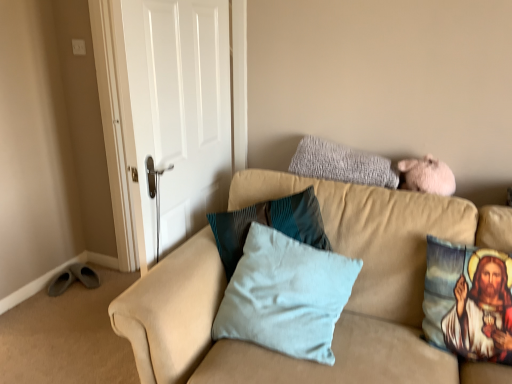
Where is `beige fabric couch at upper right`? The height and width of the screenshot is (384, 512). beige fabric couch at upper right is located at coordinates (345, 306).

I want to click on light blue fabric pillow at center, positioned as the first pillow in left-to-right order, so click(286, 295).

This screenshot has width=512, height=384. What do you see at coordinates (468, 301) in the screenshot?
I see `printed fabric pillow with religious image at right, the third pillow when ordered from left to right` at bounding box center [468, 301].

The image size is (512, 384). What do you see at coordinates (341, 164) in the screenshot? I see `gray fluffy pillow at upper right, which is the second pillow in right-to-left order` at bounding box center [341, 164].

Where is `white matte door at upper left`? The width and height of the screenshot is (512, 384). white matte door at upper left is located at coordinates (174, 114).

The width and height of the screenshot is (512, 384). Find the location of `beige fabric couch at upper right`. beige fabric couch at upper right is located at coordinates (345, 306).

Is gray fluffy pillow at upper right, placed as the second pillow when sorted from left to right, positioned with its back to white matte door at upper left?

gray fluffy pillow at upper right, placed as the second pillow when sorted from left to right, is not turned away from white matte door at upper left.

Does gray fluffy pillow at upper right, placed as the second pillow when sorted from left to right, lie behind white matte door at upper left?

Yes, gray fluffy pillow at upper right, placed as the second pillow when sorted from left to right, is further from the viewer.

Is gray fluffy pillow at upper right, placed as the second pillow when sorted from left to right, next to white matte door at upper left?

No.

Considering the positions of point (182, 310) and point (330, 299), is point (182, 310) closer or farther from the camera than point (330, 299)?

Point (182, 310) appears to be closer to the viewer than point (330, 299).

Is beige fabric couch at upper right turned away from light blue fabric pillow at center, the third pillow positioned from the right?

Yes, beige fabric couch at upper right's orientation is away from light blue fabric pillow at center, the third pillow positioned from the right.

From a real-world perspective, relative to light blue fabric pillow at center, the third pillow positioned from the right, is beige fabric couch at upper right vertically above or below?

In terms of real-world spatial position, beige fabric couch at upper right is below light blue fabric pillow at center, the third pillow positioned from the right.

Can you confirm if white matte door at upper left is bigger than printed fabric pillow with religious image at right, the third pillow when ordered from left to right?

Yes.

Is printed fabric pillow with religious image at right, positioned as the 1th pillow in right-to-left order, a part of white matte door at upper left?

That's incorrect, printed fabric pillow with religious image at right, positioned as the 1th pillow in right-to-left order, is not inside white matte door at upper left.

From the image's perspective, is white matte door at upper left beneath printed fabric pillow with religious image at right, positioned as the 1th pillow in right-to-left order?

No, from the image's perspective, white matte door at upper left is not beneath printed fabric pillow with religious image at right, positioned as the 1th pillow in right-to-left order.

Does white matte door at upper left have a lesser width compared to printed fabric pillow with religious image at right, the third pillow when ordered from left to right?

Indeed, white matte door at upper left has a lesser width compared to printed fabric pillow with religious image at right, the third pillow when ordered from left to right.

Considering the points (280, 347) and (475, 270), which point is in front, point (280, 347) or point (475, 270)?

Positioned in front is point (280, 347).

Between light blue fabric pillow at center, the third pillow positioned from the right, and printed fabric pillow with religious image at right, the third pillow when ordered from left to right, which one is positioned in front?

light blue fabric pillow at center, the third pillow positioned from the right.

From a real-world perspective, is light blue fabric pillow at center, the third pillow positioned from the right, positioned under printed fabric pillow with religious image at right, positioned as the 1th pillow in right-to-left order, based on gravity?

Yes.

Does light blue fabric pillow at center, positioned as the first pillow in left-to-right order, touch printed fabric pillow with religious image at right, the third pillow when ordered from left to right?

No, light blue fabric pillow at center, positioned as the first pillow in left-to-right order, is not next to printed fabric pillow with religious image at right, the third pillow when ordered from left to right.

How different are the orientations of white matte door at upper left and light blue fabric pillow at center, positioned as the first pillow in left-to-right order, in degrees?

white matte door at upper left and light blue fabric pillow at center, positioned as the first pillow in left-to-right order, are facing 89 degrees away from each other.

Does white matte door at upper left lie behind light blue fabric pillow at center, the third pillow positioned from the right?

Yes, it is behind light blue fabric pillow at center, the third pillow positioned from the right.

From the image's perspective, would you say white matte door at upper left is positioned over light blue fabric pillow at center, the third pillow positioned from the right?

Yes, from the image's perspective, white matte door at upper left is over light blue fabric pillow at center, the third pillow positioned from the right.

Looking at this image, is gray fluffy pillow at upper right, which is the second pillow in right-to-left order, far from light blue fabric pillow at center, positioned as the first pillow in left-to-right order?

Actually, gray fluffy pillow at upper right, which is the second pillow in right-to-left order, and light blue fabric pillow at center, positioned as the first pillow in left-to-right order, are a little close together.

Between point (326, 148) and point (286, 264), which one is positioned behind?

The point (326, 148) is farther.

Could you tell me if gray fluffy pillow at upper right, which is the second pillow in right-to-left order, is turned towards light blue fabric pillow at center, positioned as the first pillow in left-to-right order?

No, gray fluffy pillow at upper right, which is the second pillow in right-to-left order, does not turn towards light blue fabric pillow at center, positioned as the first pillow in left-to-right order.

From the image's perspective, which is above, white matte door at upper left or beige fabric couch at upper right?

white matte door at upper left appears higher in the image.

Does white matte door at upper left appear on the left side of beige fabric couch at upper right?

Correct, you'll find white matte door at upper left to the left of beige fabric couch at upper right.

Between point (176, 111) and point (161, 372), which one is positioned in front?

The point (161, 372) is closer to the camera.

Which of these two, white matte door at upper left or beige fabric couch at upper right, is bigger?

Bigger between the two is beige fabric couch at upper right.

From a real-world perspective, which pillow is the 1st one underneath the white matte door at upper left? Please provide its 2D coordinates.

[(341, 164)]

I want to click on the 2nd pillow above the beige fabric couch at upper right (from the image's perspective), so click(286, 295).

Looking at the image, which one is located closer to gray fluffy pillow at upper right, placed as the second pillow when sorted from left to right, beige fabric couch at upper right or light blue fabric pillow at center, positioned as the first pillow in left-to-right order?

Among the two, beige fabric couch at upper right is located nearer to gray fluffy pillow at upper right, placed as the second pillow when sorted from left to right.

Based on the photo, which object lies nearer to the anchor point gray fluffy pillow at upper right, which is the second pillow in right-to-left order, beige fabric couch at upper right or printed fabric pillow with religious image at right, positioned as the 1th pillow in right-to-left order?

beige fabric couch at upper right.

Based on their spatial positions, is beige fabric couch at upper right or white matte door at upper left further from light blue fabric pillow at center, positioned as the first pillow in left-to-right order?

white matte door at upper left.

Which object lies nearer to the anchor point printed fabric pillow with religious image at right, the third pillow when ordered from left to right, gray fluffy pillow at upper right, which is the second pillow in right-to-left order, or light blue fabric pillow at center, the third pillow positioned from the right?

The object closer to printed fabric pillow with religious image at right, the third pillow when ordered from left to right, is light blue fabric pillow at center, the third pillow positioned from the right.

Looking at the image, which one is located closer to beige fabric couch at upper right, gray fluffy pillow at upper right, which is the second pillow in right-to-left order, or light blue fabric pillow at center, positioned as the first pillow in left-to-right order?

Based on the image, light blue fabric pillow at center, positioned as the first pillow in left-to-right order, appears to be nearer to beige fabric couch at upper right.

When comparing their distances from gray fluffy pillow at upper right, which is the second pillow in right-to-left order, does white matte door at upper left or light blue fabric pillow at center, the third pillow positioned from the right, seem further?

The object further to gray fluffy pillow at upper right, which is the second pillow in right-to-left order, is white matte door at upper left.

When comparing their distances from white matte door at upper left, does light blue fabric pillow at center, positioned as the first pillow in left-to-right order, or gray fluffy pillow at upper right, which is the second pillow in right-to-left order, seem closer?

The object closer to white matte door at upper left is light blue fabric pillow at center, positioned as the first pillow in left-to-right order.

Looking at the image, which one is located further to printed fabric pillow with religious image at right, positioned as the 1th pillow in right-to-left order, white matte door at upper left or light blue fabric pillow at center, positioned as the first pillow in left-to-right order?

white matte door at upper left is further to printed fabric pillow with religious image at right, positioned as the 1th pillow in right-to-left order.

Find the location of a particular element. pillow between light blue fabric pillow at center, positioned as the first pillow in left-to-right order, and printed fabric pillow with religious image at right, positioned as the 1th pillow in right-to-left order, in the horizontal direction is located at coordinates point(341,164).

In order to click on studio couch situated between light blue fabric pillow at center, the third pillow positioned from the right, and printed fabric pillow with religious image at right, the third pillow when ordered from left to right, from left to right in this screenshot , I will do `click(345, 306)`.

Where is `door between beige fabric couch at upper right and gray fluffy pillow at upper right, placed as the second pillow when sorted from left to right, in the front-back direction`? The width and height of the screenshot is (512, 384). door between beige fabric couch at upper right and gray fluffy pillow at upper right, placed as the second pillow when sorted from left to right, in the front-back direction is located at coordinates (174, 114).

I want to click on studio couch between white matte door at upper left and printed fabric pillow with religious image at right, the third pillow when ordered from left to right, from left to right, so click(345, 306).